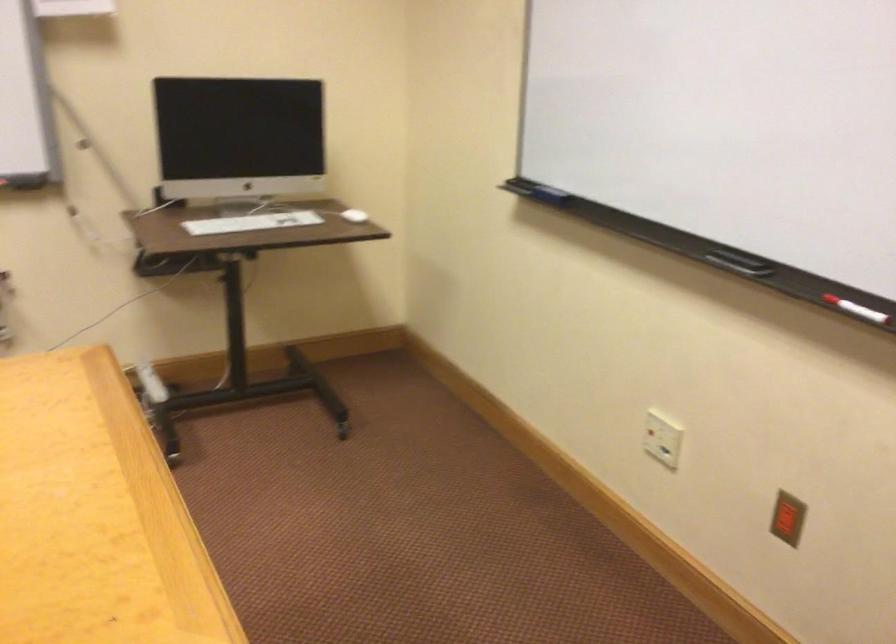
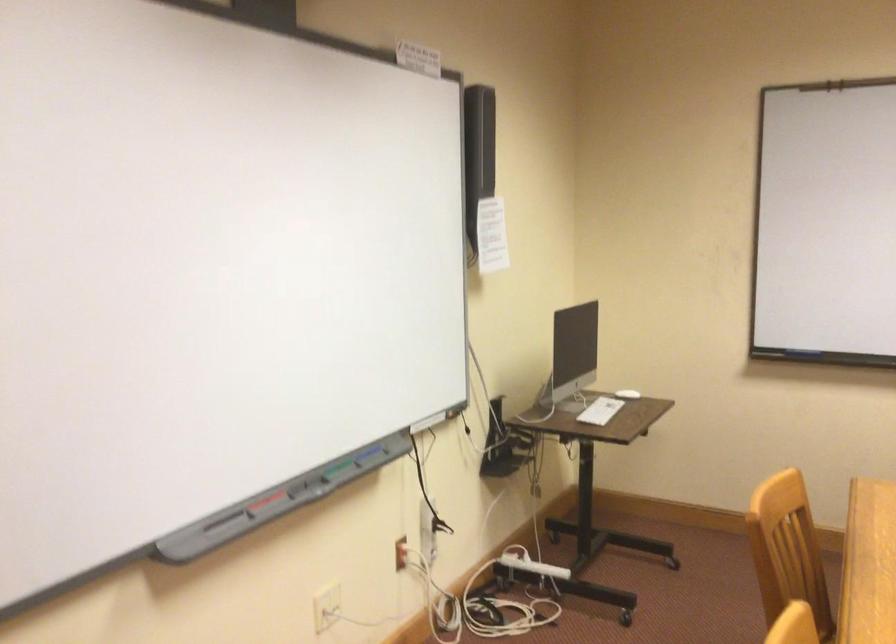
The point at (156, 379) is marked in the first image. Where is the corresponding point in the second image?

(530, 564)